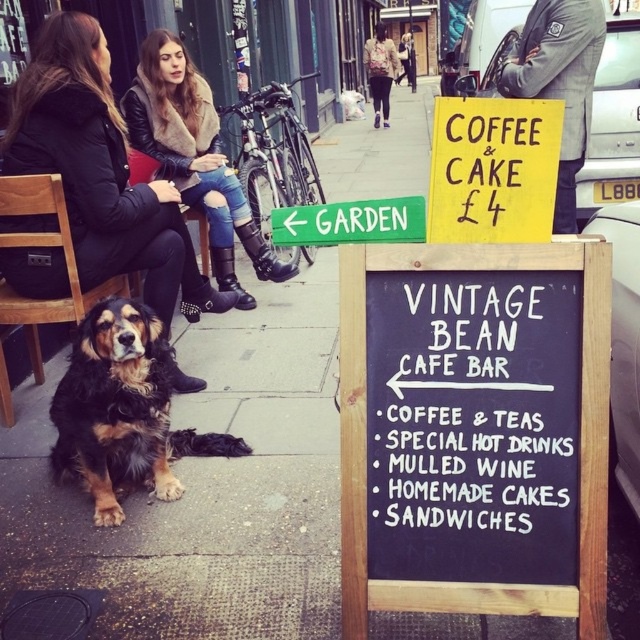
You are a photographer trying to capture both the leather jacket at upper left and the leather jacket at upper center in a single frame. Based on their heights, which jacket will appear larger in the photo?

The leather jacket at upper center will appear larger in the photo because it is taller than the leather jacket at upper left.